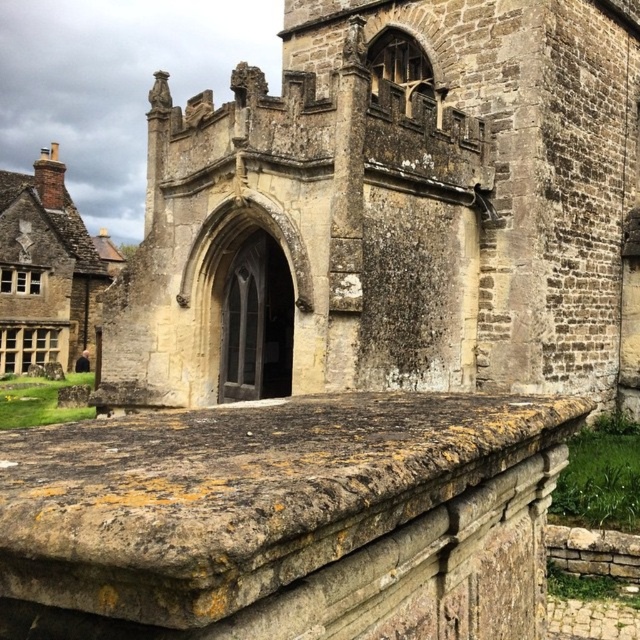
Can you confirm if weathered stone ledge at center is positioned to the left of stone chimney at left?

Incorrect, weathered stone ledge at center is not on the left side of stone chimney at left.

Is point (35, 540) behind point (28, 352)?

No.

Find the location of `weathered stone ledge at center`. weathered stone ledge at center is located at coordinates (285, 518).

Which is more to the left, stone church at center or stone chimney at left?

Positioned to the left is stone chimney at left.

Is stone church at center to the right of stone chimney at left from the viewer's perspective?

Correct, you'll find stone church at center to the right of stone chimney at left.

Between point (150, 189) and point (104, 275), which one is positioned in front?

Point (150, 189) is in front.

In order to click on stone church at center in this screenshot , I will do `click(397, 209)`.

Which is below, stone church at center or weathered stone ledge at center?

weathered stone ledge at center

What do you see at coordinates (397, 209) in the screenshot?
I see `stone church at center` at bounding box center [397, 209].

Image resolution: width=640 pixels, height=640 pixels. I want to click on stone church at center, so click(x=397, y=209).